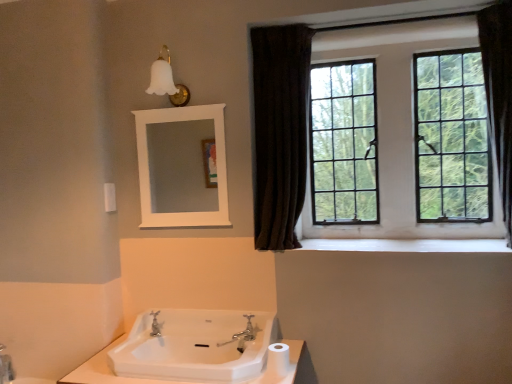
Question: From a real-world perspective, is white plastic towel bar at upper left above or below black glass window at upper right?

Choices:
 (A) below
 (B) above

Answer: (A)

Question: In terms of size, does white plastic towel bar at upper left appear bigger or smaller than black glass window at upper right?

Choices:
 (A) small
 (B) big

Answer: (A)

Question: Estimate the real-world distances between objects in this image. Which object is closer to the white matte toilet paper at lower center?

Choices:
 (A) silver metallic faucet at center
 (B) black glass window at upper right
 (C) brown fabric curtain at right
 (D) white wooden mirror at upper center
 (E) white glass sconce at upper left

Answer: (A)

Question: Estimate the real-world distances between objects in this image. Which object is farther from the brown fabric curtain at right?

Choices:
 (A) white smooth window sill at lower center
 (B) black glass window at upper right
 (C) white wooden mirror at upper center
 (D) silver metallic faucet at center
 (E) white matte toilet paper at lower center

Answer: (C)